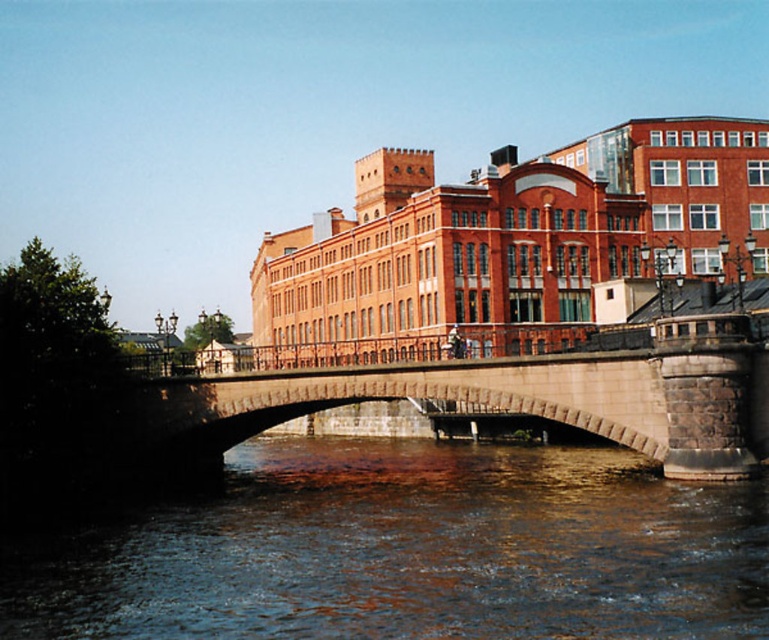
You are standing at the point marked as point (408, 550) in the image. What is the color and material of the surface you are currently standing on?

The surface at point (408, 550) is brown stone water at center, which is made of brown stone and has a water surface.

You are a tourist standing on the riverbank and want to cross to the other side. You see the brown stone water at center and the stone bridge at center. Which one should you choose to cross the river safely?

The stone bridge at center is the safe option to cross the river because it is a solid structure designed for passage, while the brown stone water at center is likely a body of water that cannot support your weight.

You are a drone operator trying to capture a photo of the brown stone water at center. The camera is currently at position point 0.861, 0.532. To ensure the water is centered in the frame, should you adjust the camera to the left or right?

The brown stone water at center is already at point (408, 550), so the camera is already positioned correctly to center it.